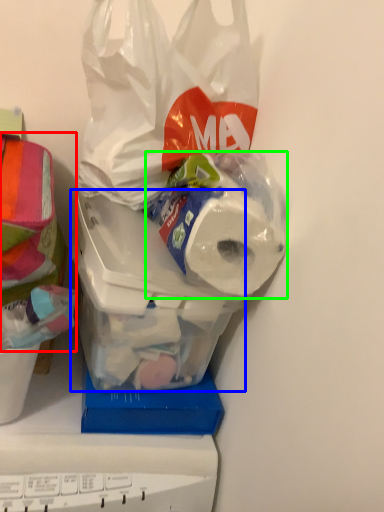
Question: Estimate the real-world distances between objects in this image. Which object is closer to wrapping paper (highlighted by a red box), wide (highlighted by a blue box) or toilet paper (highlighted by a green box)?

Choices:
 (A) wide
 (B) toilet paper

Answer: (A)